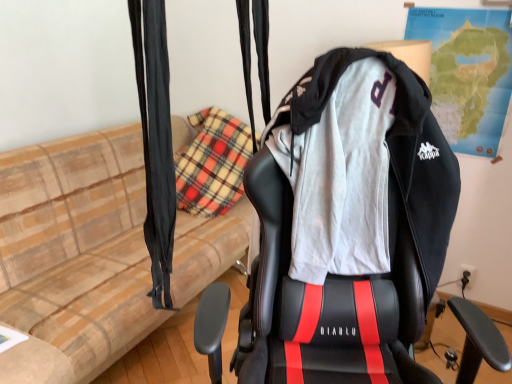
The image size is (512, 384). Describe the element at coordinates (349, 276) in the screenshot. I see `black leather gaming chair at center` at that location.

Identify the location of black leather gaming chair at center. Image resolution: width=512 pixels, height=384 pixels. (349, 276).

In order to click on curtain that is above the beige plaid couch at left (from the image's perspective) in this screenshot , I will do point(156,141).

Is black fabric curtain at left closer to the viewer compared to beige plaid couch at left?

Yes, it is in front of beige plaid couch at left.

Does black fabric curtain at left touch beige plaid couch at left?

No, black fabric curtain at left is not in contact with beige plaid couch at left.

From the image's perspective, which is below, black fabric curtain at left or beige plaid couch at left?

beige plaid couch at left is shown below in the image.

In the scene shown: Is black fabric curtain at left to the left of paper map at upper right from the viewer's perspective?

Yes, black fabric curtain at left is to the left of paper map at upper right.

Considering the sizes of black fabric curtain at left and paper map at upper right in the image, is black fabric curtain at left taller or shorter than paper map at upper right?

In the image, black fabric curtain at left appears to be shorter than paper map at upper right.

Is black fabric curtain at left not close to paper map at upper right?

That's right, there is a large distance between black fabric curtain at left and paper map at upper right.

Who is shorter, beige plaid couch at left or black fabric curtain at left?

With less height is black fabric curtain at left.

Is beige plaid couch at left not near black fabric curtain at left?

That's right, there is a large distance between beige plaid couch at left and black fabric curtain at left.

Is beige plaid couch at left looking in the opposite direction of black fabric curtain at left?

beige plaid couch at left is not turned away from black fabric curtain at left.

In the scene shown: Is beige plaid couch at left outside of black fabric curtain at left?

Yes, beige plaid couch at left is located beyond the bounds of black fabric curtain at left.

Relative to black fabric curtain at left, is black leather gaming chair at center in front or behind?

In the image, black leather gaming chair at center appears in front of black fabric curtain at left.

Is black leather gaming chair at center thinner than black fabric curtain at left?

No, black leather gaming chair at center is not thinner than black fabric curtain at left.

Which is more to the right, black leather gaming chair at center or black fabric curtain at left?

black leather gaming chair at center is more to the right.

From a real-world perspective, is black leather gaming chair at center physically located above or below black fabric curtain at left?

From a real-world perspective, black leather gaming chair at center is physically below black fabric curtain at left.

Is black leather gaming chair at center to the left of paper map at upper right from the viewer's perspective?

Yes, black leather gaming chair at center is to the left of paper map at upper right.

From the picture: From a real-world perspective, does black leather gaming chair at center stand above paper map at upper right?

No, from a real-world perspective, black leather gaming chair at center is not above paper map at upper right.

Are black leather gaming chair at center and paper map at upper right making contact?

black leather gaming chair at center and paper map at upper right are clearly separated.

Which of these two, black leather gaming chair at center or paper map at upper right, is bigger?

With larger size is black leather gaming chair at center.

Which of these two, beige plaid couch at left or paper map at upper right, is thinner?

With smaller width is paper map at upper right.

Measure the distance from beige plaid couch at left to paper map at upper right.

beige plaid couch at left is 5.13 feet from paper map at upper right.

Does beige plaid couch at left have a lesser height compared to paper map at upper right?

In fact, beige plaid couch at left may be taller than paper map at upper right.

Is beige plaid couch at left turned away from paper map at upper right?

No, beige plaid couch at left's orientation is not away from paper map at upper right.

Considering the relative positions of black leather gaming chair at center and beige plaid couch at left in the image provided, is black leather gaming chair at center behind beige plaid couch at left?

No, black leather gaming chair at center is in front of beige plaid couch at left.

Which object is positioned more to the right, black leather gaming chair at center or beige plaid couch at left?

From the viewer's perspective, black leather gaming chair at center appears more on the right side.

Who is taller, black leather gaming chair at center or beige plaid couch at left?

black leather gaming chair at center.

Is black leather gaming chair at center wider or thinner than beige plaid couch at left?

Clearly, black leather gaming chair at center has less width compared to beige plaid couch at left.

Find the location of a particular element. curtain above the beige plaid couch at left (from the image's perspective) is located at coordinates (156, 141).

Where is `map behind the black fabric curtain at left`? map behind the black fabric curtain at left is located at coordinates (467, 73).

Considering their positions, is beige plaid couch at left positioned closer to paper map at upper right than black leather gaming chair at center?

black leather gaming chair at center lies closer to paper map at upper right than the other object.

From the image, which object appears to be farther from black fabric curtain at left, black leather gaming chair at center or beige plaid couch at left?

beige plaid couch at left lies further to black fabric curtain at left than the other object.

Which object lies further to the anchor point black fabric curtain at left, beige plaid couch at left or black leather gaming chair at center?

The object further to black fabric curtain at left is beige plaid couch at left.

When comparing their distances from paper map at upper right, does black fabric curtain at left or black leather gaming chair at center seem further?

black fabric curtain at left lies further to paper map at upper right than the other object.

Estimate the real-world distances between objects in this image. Which object is closer to beige plaid couch at left, black fabric curtain at left or black leather gaming chair at center?

The object closer to beige plaid couch at left is black leather gaming chair at center.

When comparing their distances from beige plaid couch at left, does black fabric curtain at left or paper map at upper right seem further?

Among the two, paper map at upper right is located further to beige plaid couch at left.

Based on their spatial positions, is beige plaid couch at left or paper map at upper right closer to black leather gaming chair at center?

beige plaid couch at left is closer to black leather gaming chair at center.

When comparing their distances from paper map at upper right, does beige plaid couch at left or black fabric curtain at left seem closer?

Among the two, beige plaid couch at left is located nearer to paper map at upper right.

Find the location of a particular element. curtain between beige plaid couch at left and paper map at upper right in the horizontal direction is located at coordinates (156, 141).

The width and height of the screenshot is (512, 384). Find the location of `curtain positioned between black leather gaming chair at center and paper map at upper right from near to far`. curtain positioned between black leather gaming chair at center and paper map at upper right from near to far is located at coordinates (156, 141).

Image resolution: width=512 pixels, height=384 pixels. Find the location of `curtain between beige plaid couch at left and black leather gaming chair at center in the horizontal direction`. curtain between beige plaid couch at left and black leather gaming chair at center in the horizontal direction is located at coordinates (156, 141).

Where is `chair situated between beige plaid couch at left and paper map at upper right from left to right`? The width and height of the screenshot is (512, 384). chair situated between beige plaid couch at left and paper map at upper right from left to right is located at coordinates (349, 276).